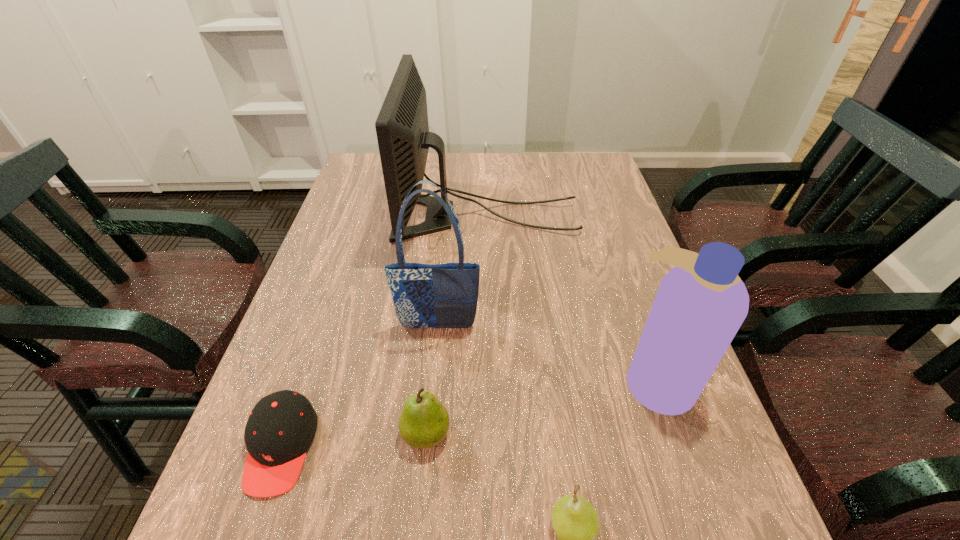
Identify the location of computer monitor. (402, 128).

This screenshot has height=540, width=960. I want to click on shopping bag, so click(445, 295).

Locate an element on the screen. The height and width of the screenshot is (540, 960). shampoo is located at coordinates (701, 303).

Identify the location of the farther pear. (424, 421).

Locate an element on the screen. This screenshot has width=960, height=540. cap is located at coordinates (281, 427).

Identify the location of the leftmost object. This screenshot has height=540, width=960. (281, 427).

The width and height of the screenshot is (960, 540). I want to click on vacant space positioned on the screen side of the farthest object, so click(366, 217).

Find the location of a particular element. The image size is (960, 540). free space located on the screen side of the farthest object is located at coordinates (379, 217).

You are a GUI agent. You are given a task and a screenshot of the screen. Output one action in this format:
    pyautogui.click(x=<x>, y=<y>)
    Task: Click on the free point located on the screen side of the farthest object
    This screenshot has height=540, width=960.
    Given the screenshot: What is the action you would take?
    pyautogui.click(x=339, y=217)

Locate an element on the screen. The image size is (960, 540). free space located 0.370m on the front-facing side of the fifth nearest object is located at coordinates tap(420, 512).